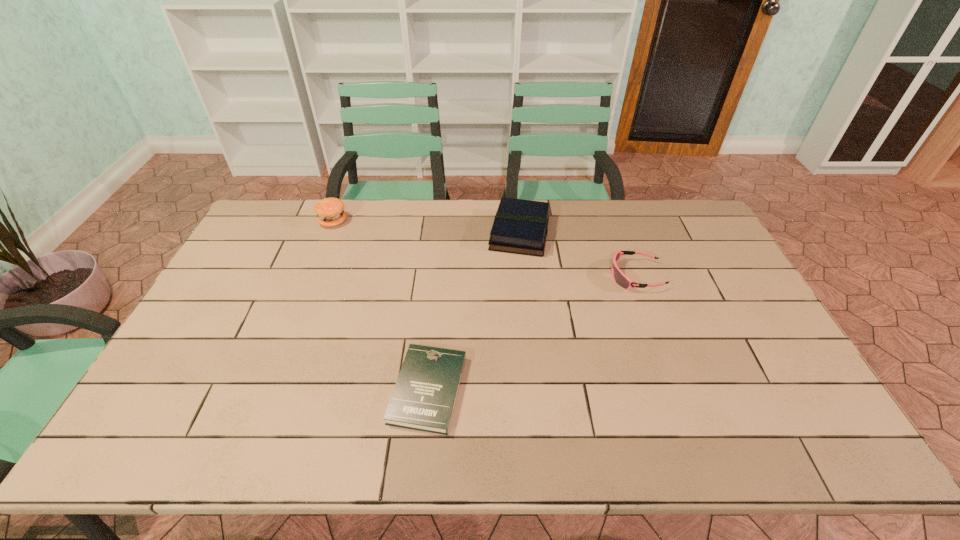
Identify the location of vacant area between the tallest object and the taller book. (426, 227).

Identify the location of vacant space in between the taller book and the nearest object. (474, 311).

In order to click on vacant region between the nearest object and the third farthest object in this screenshot , I will do `click(532, 333)`.

Where is `object that is the third closest to the second nearest object`? The height and width of the screenshot is (540, 960). object that is the third closest to the second nearest object is located at coordinates (330, 212).

Identify the location of object that is the third closest one to the farther book. (330, 212).

The height and width of the screenshot is (540, 960). I want to click on free region that satisfies the following two spatial constraints: 1. on the front side of the nearer book; 2. on the right side of the tallest object, so (x=266, y=390).

You are a GUI agent. You are given a task and a screenshot of the screen. Output one action in this format:
    pyautogui.click(x=<x>, y=<y>)
    Task: Click on the free spot that satisfies the following two spatial constraints: 1. on the front side of the nearest object; 2. on the right side of the leftmost object
    
    Given the screenshot: What is the action you would take?
    pyautogui.click(x=266, y=390)